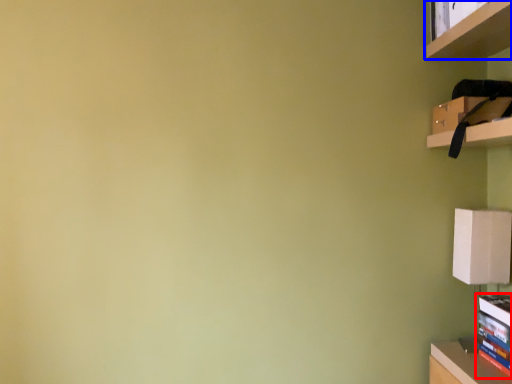
Question: Among these objects, which one is farthest to the camera, book (highlighted by a red box) or shelf (highlighted by a blue box)?

Choices:
 (A) book
 (B) shelf

Answer: (A)